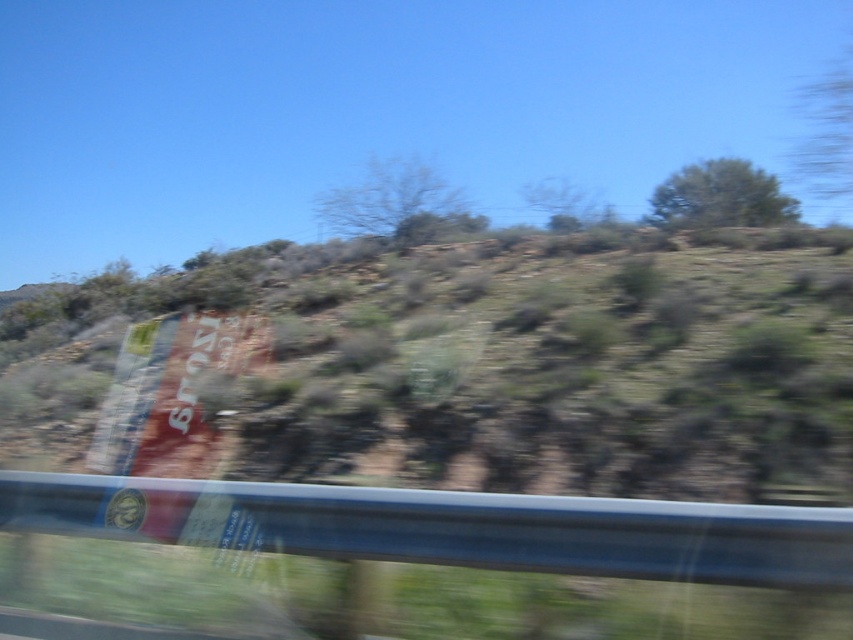
Does green shrubbery at center have a larger size compared to transparent glass car window at lower left?

Correct, green shrubbery at center is larger in size than transparent glass car window at lower left.

Between point (752, 280) and point (747, 518), which one is positioned behind?

The point (752, 280) is more distant.

Looking at this image, measure the distance between green shrubbery at center and camera.

green shrubbery at center is 7.79 meters away from camera.

Identify the location of green shrubbery at center. pos(463,369).